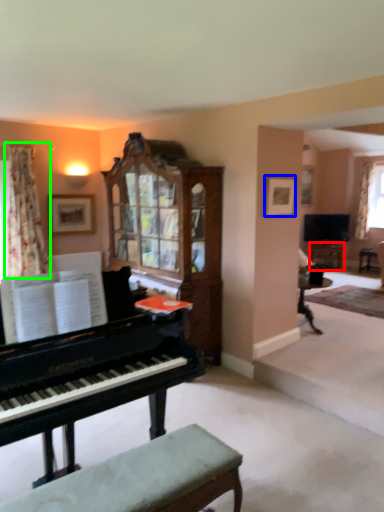
Question: Based on their relative distances, which object is farther from table (highlighted by a red box)? Choose from picture frame (highlighted by a blue box) and curtain (highlighted by a green box).

Choices:
 (A) picture frame
 (B) curtain

Answer: (B)